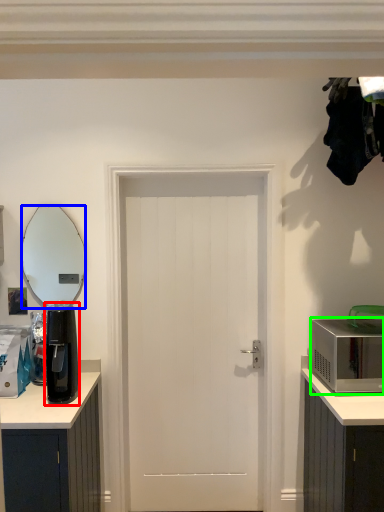
Question: Considering the real-world distances, which object is farthest from appliance (highlighted by a red box)? mirror (highlighted by a blue box) or microwave oven (highlighted by a green box)?

Choices:
 (A) mirror
 (B) microwave oven

Answer: (A)